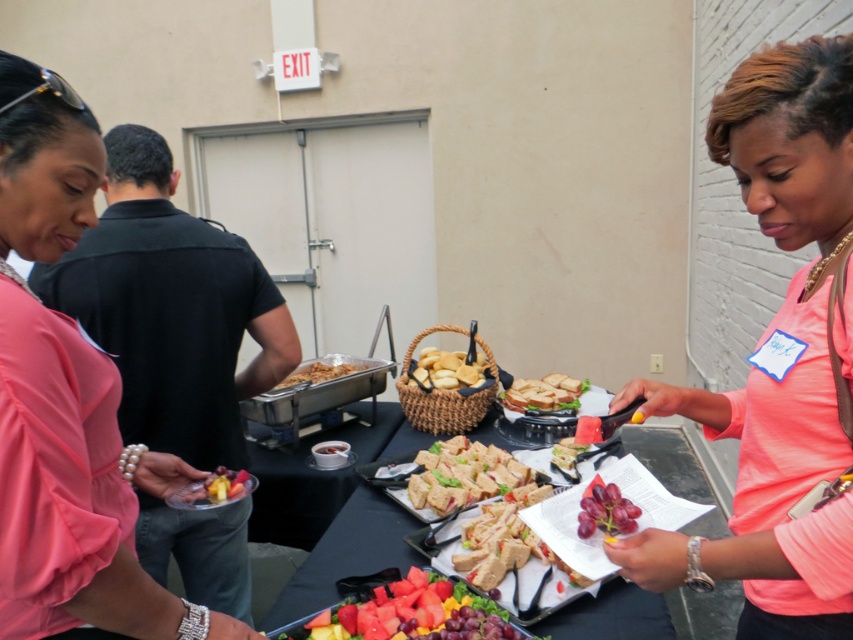
In the scene described, there is a person wearing a pink fabric shirt at left and a white bread sandwich at center. From the perspective of someone standing at the entrance of the room, which object is positioned more to the left?

The pink fabric shirt at left is positioned more to the left than the white bread sandwich at center.

You are standing at the point marked by the coordinate point at (x=380, y=621). You want to move to the buffet table located at the opposite end of the room. There are two people in front of you. The first person is wearing a pink shirt and holding a plate with fruit, and the second person is wearing a coral shirt and holding a name tag. Which direction should you move to avoid both of them and reach the buffet table?

To avoid both the pink shirted person and the coral shirted person, you should move to the left side of the two individuals since they are 1.24 meters apart, allowing enough space to navigate around them towards the buffet table.

You are at a buffet and want to grab some fruit. You see the juicy watermelon at center and the shiny plastic fruit at center. Which one is positioned lower?

The juicy watermelon at center is located below the shiny plastic fruit at center, so the juicy watermelon at center is positioned lower.